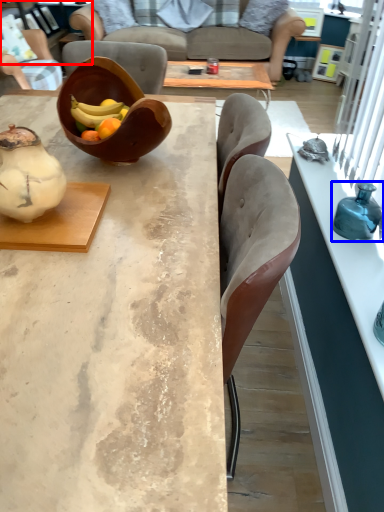
Question: Which of the following is the farthest to the observer, cabinetry (highlighted by a red box) or bottle (highlighted by a blue box)?

Choices:
 (A) cabinetry
 (B) bottle

Answer: (A)